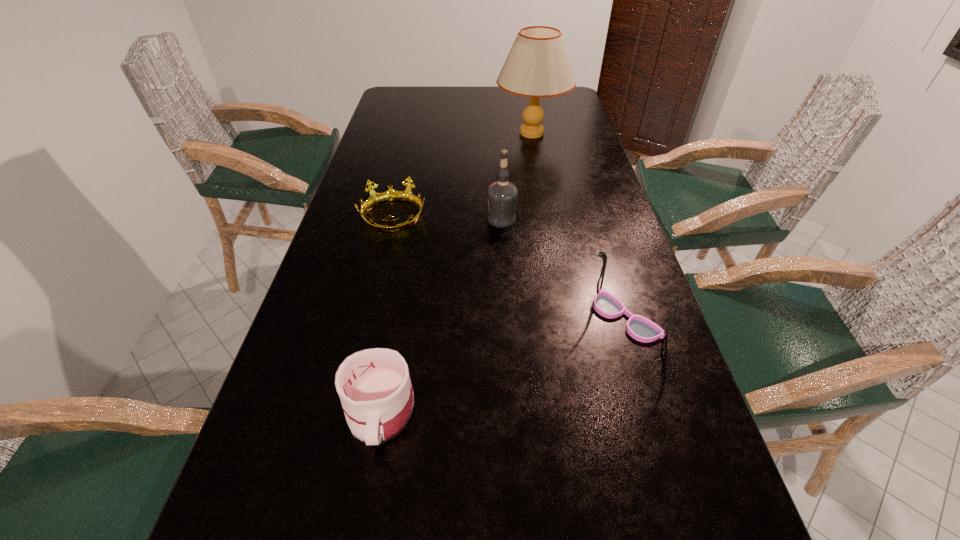
I want to click on the farthest object, so click(x=537, y=66).

The height and width of the screenshot is (540, 960). I want to click on the tallest object, so click(x=537, y=66).

The image size is (960, 540). I want to click on vodka, so click(x=502, y=195).

Where is `the third tallest object`? This screenshot has width=960, height=540. the third tallest object is located at coordinates (640, 328).

What are the coordinates of `the fourth farthest object` in the screenshot? It's located at click(640, 328).

Where is `the nearest object`? The height and width of the screenshot is (540, 960). the nearest object is located at coordinates (374, 386).

Identify the location of the fourth tallest object. The height and width of the screenshot is (540, 960). (374, 386).

Find the location of `crown`. crown is located at coordinates (375, 198).

This screenshot has width=960, height=540. I want to click on free location located on the back of the farthest object, so click(527, 105).

Where is `free region located on the front label of the second tallest object`? free region located on the front label of the second tallest object is located at coordinates (408, 219).